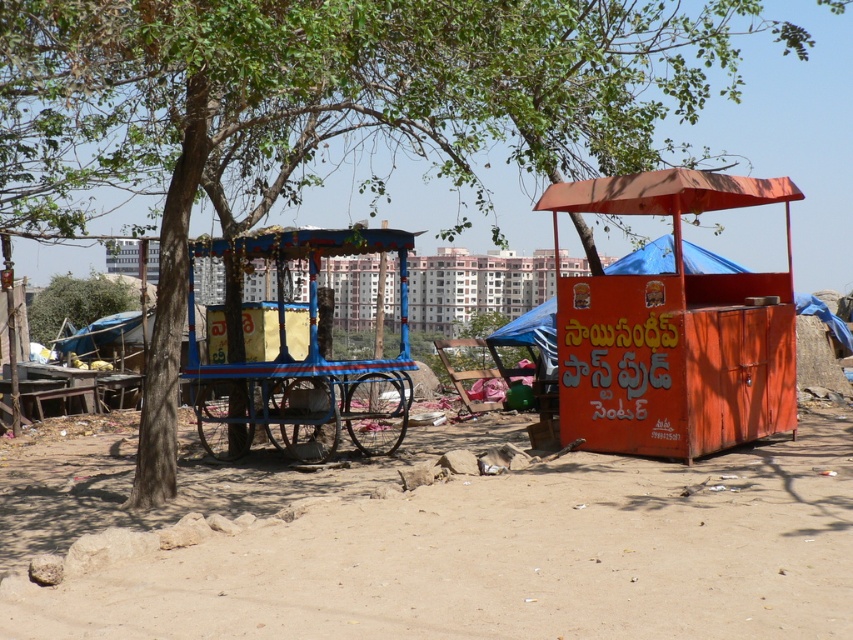
Looking at this image, between green leafy tree at center and blue fabric canopy at center, which one has less height?

blue fabric canopy at center

What do you see at coordinates (76, 304) in the screenshot?
I see `green leafy tree at center` at bounding box center [76, 304].

The width and height of the screenshot is (853, 640). I want to click on green leafy tree at center, so click(76, 304).

The height and width of the screenshot is (640, 853). What do you see at coordinates (674, 330) in the screenshot?
I see `orange painted cart at right` at bounding box center [674, 330].

Which is above, orange painted cart at right or green leafy tree at center?

green leafy tree at center is higher up.

Is point (612, 211) positioned behind point (32, 323)?

That is False.

This screenshot has height=640, width=853. Find the location of `orange painted cart at right`. orange painted cart at right is located at coordinates (674, 330).

Can you confirm if blue painted wood cart at center is positioned to the left of green leafy tree at center?

No, blue painted wood cart at center is not to the left of green leafy tree at center.

Does blue painted wood cart at center appear on the right side of green leafy tree at center?

Yes, blue painted wood cart at center is to the right of green leafy tree at center.

Is point (245, 248) positioned behind point (77, 291)?

No, (245, 248) is in front of (77, 291).

Find the location of a particular element. The width and height of the screenshot is (853, 640). blue painted wood cart at center is located at coordinates (305, 364).